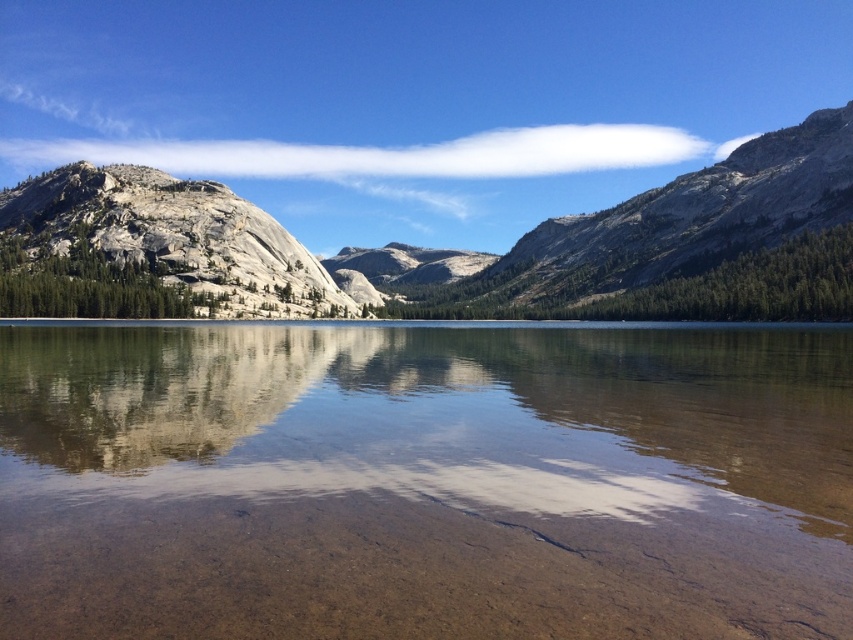
Based on the coordinates provided, what type of mountain is located at point (491, 253) in the image?

The point (491, 253) indicates a granite mountain at center.

You are planning to hike up both the smooth stone mountain at center and the granite mountain at left. Based on the scene, which mountain would require more stamina due to its height?

The granite mountain at left requires more stamina because it is taller than the smooth stone mountain at center.

You are standing on the lakeshore and want to climb the mountains. Which mountain, the smooth stone mountain at center or the granite mountain at left, is closer to you?

The smooth stone mountain at center is closer to you because it is positioned below the granite mountain at left, indicating it is nearer in the scene.